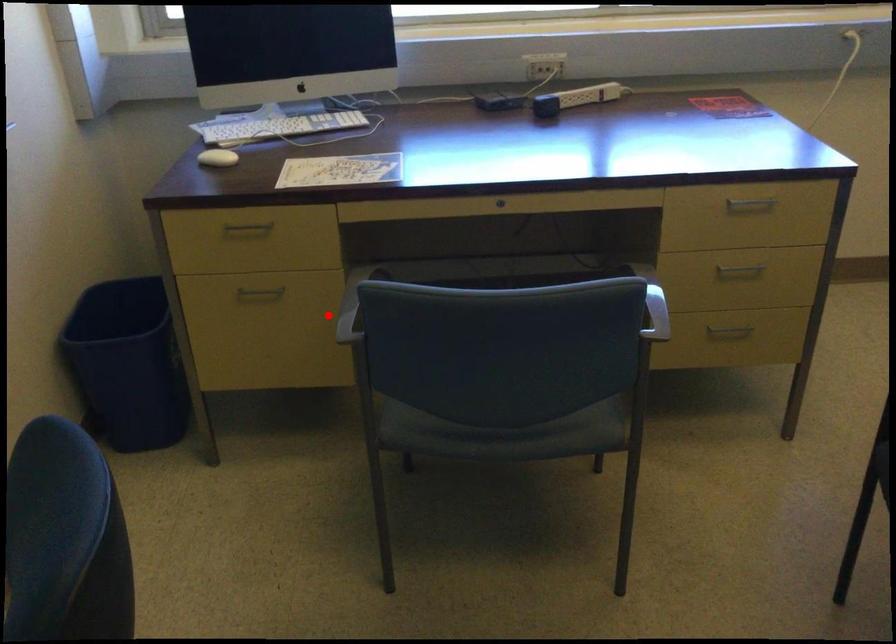
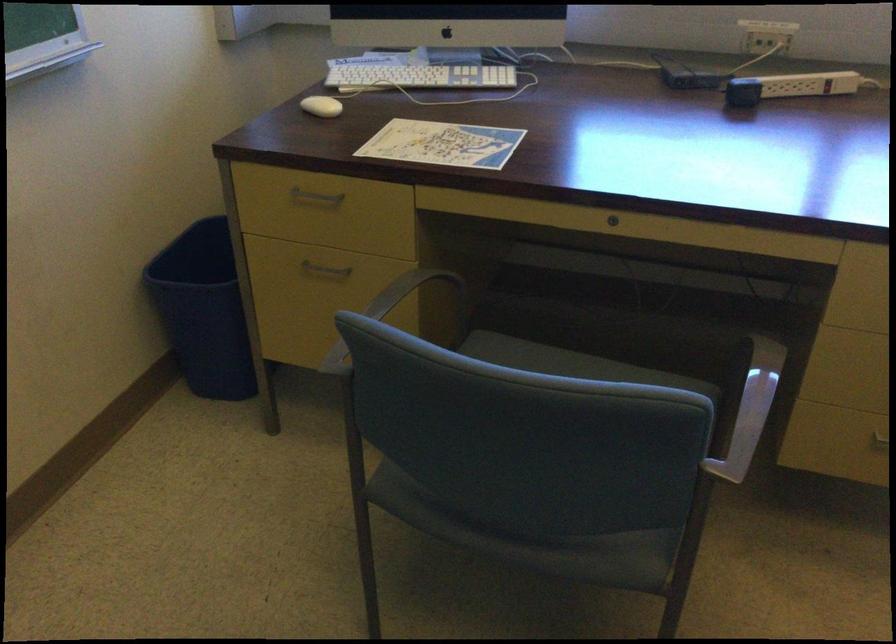
Where in the second image is the point corresponding to the highlighted location from the first image?

(393, 308)